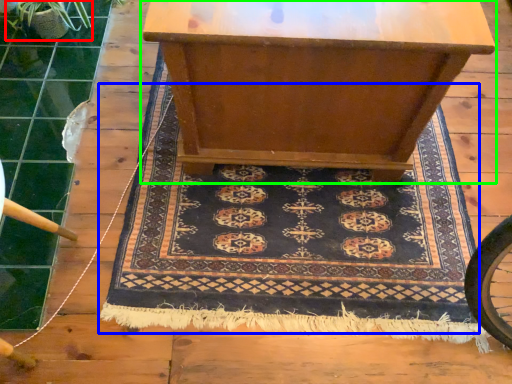
Question: Which object is the closest to the plant (highlighted by a red box)? Choose among these: mat (highlighted by a blue box) or table (highlighted by a green box).

Choices:
 (A) mat
 (B) table

Answer: (B)